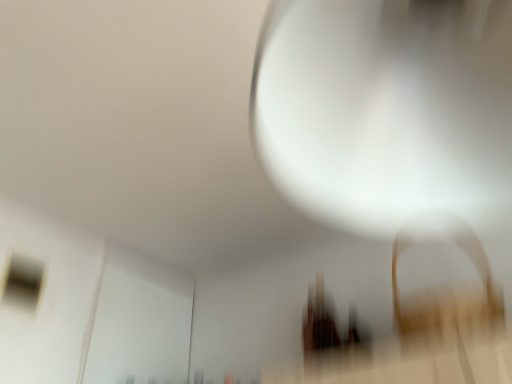
Image resolution: width=512 pixels, height=384 pixels. Describe the element at coordinates (22, 282) in the screenshot. I see `matte glass window at upper left` at that location.

Where is `matte glass window at upper left`? The image size is (512, 384). matte glass window at upper left is located at coordinates (22, 282).

Identify the location of white glossy light bulb at upper center. This screenshot has height=384, width=512. (386, 110).

Describe the element at coordinates (386, 110) in the screenshot. I see `white glossy light bulb at upper center` at that location.

The width and height of the screenshot is (512, 384). Find the location of `matte glass window at upper left`. matte glass window at upper left is located at coordinates (22, 282).

Looking at this image, considering the relative positions of white glossy light bulb at upper center and matte glass window at upper left in the image provided, is white glossy light bulb at upper center to the right of matte glass window at upper left from the viewer's perspective?

Correct, you'll find white glossy light bulb at upper center to the right of matte glass window at upper left.

Considering the relative positions of white glossy light bulb at upper center and matte glass window at upper left in the image provided, is white glossy light bulb at upper center in front of matte glass window at upper left?

Yes, white glossy light bulb at upper center is closer to the viewer.

Between point (482, 74) and point (4, 288), which one is positioned behind?

The point (4, 288) is farther.

From the image's perspective, is white glossy light bulb at upper center below matte glass window at upper left?

No, from the image's perspective, white glossy light bulb at upper center is not below matte glass window at upper left.

From the picture: From a real-world perspective, between white glossy light bulb at upper center and matte glass window at upper left, who is vertically lower?

In real-world perspective, white glossy light bulb at upper center is lower.

Considering the sizes of objects white glossy light bulb at upper center and matte glass window at upper left in the image provided, who is wider, white glossy light bulb at upper center or matte glass window at upper left?

With larger width is white glossy light bulb at upper center.

Is white glossy light bulb at upper center taller or shorter than matte glass window at upper left?

white glossy light bulb at upper center is taller than matte glass window at upper left.

Considering the sizes of objects white glossy light bulb at upper center and matte glass window at upper left in the image provided, who is smaller, white glossy light bulb at upper center or matte glass window at upper left?

With smaller size is matte glass window at upper left.

Could matte glass window at upper left be considered to be inside white glossy light bulb at upper center?

No, matte glass window at upper left is located outside of white glossy light bulb at upper center.

Is white glossy light bulb at upper center not near matte glass window at upper left?

Indeed, white glossy light bulb at upper center is not near matte glass window at upper left.

Is white glossy light bulb at upper center facing away from matte glass window at upper left?

No, white glossy light bulb at upper center's orientation is not away from matte glass window at upper left.

What's the angular difference between white glossy light bulb at upper center and matte glass window at upper left's facing directions?

They differ by 88.2 degrees in their facing directions.

Locate an element on the screen. light in front of the matte glass window at upper left is located at coordinates (386, 110).

Considering the relative positions of matte glass window at upper left and white glossy light bulb at upper center in the image provided, is matte glass window at upper left to the left of white glossy light bulb at upper center from the viewer's perspective?

Correct, you'll find matte glass window at upper left to the left of white glossy light bulb at upper center.

Between matte glass window at upper left and white glossy light bulb at upper center, which one is positioned behind?

matte glass window at upper left is further away from the camera.

Considering the points (40, 284) and (490, 162), which point is behind, point (40, 284) or point (490, 162)?

The point (40, 284) is farther from the camera.

From the image's perspective, would you say matte glass window at upper left is shown under white glossy light bulb at upper center?

Indeed, from the image's perspective, matte glass window at upper left is shown beneath white glossy light bulb at upper center.

From a real-world perspective, which is physically below, matte glass window at upper left or white glossy light bulb at upper center?

In real-world perspective, white glossy light bulb at upper center is lower.

Considering the sizes of matte glass window at upper left and white glossy light bulb at upper center in the image, is matte glass window at upper left wider or thinner than white glossy light bulb at upper center?

Considering their sizes, matte glass window at upper left looks slimmer than white glossy light bulb at upper center.

From the picture: Who is taller, matte glass window at upper left or white glossy light bulb at upper center?

white glossy light bulb at upper center is taller.

In terms of size, does matte glass window at upper left appear bigger or smaller than white glossy light bulb at upper center?

In the image, matte glass window at upper left appears to be smaller than white glossy light bulb at upper center.

In the scene shown: Is matte glass window at upper left inside the boundaries of white glossy light bulb at upper center, or outside?

matte glass window at upper left is not inside white glossy light bulb at upper center, it's outside.

Is matte glass window at upper left not close to white glossy light bulb at upper center?

Indeed, matte glass window at upper left is not near white glossy light bulb at upper center.

Could you tell me if matte glass window at upper left is turned towards white glossy light bulb at upper center?

Yes, matte glass window at upper left is oriented towards white glossy light bulb at upper center.

Locate an element on the screen. light in front of the matte glass window at upper left is located at coordinates (386, 110).

Locate an element on the screen. Image resolution: width=512 pixels, height=384 pixels. light above the matte glass window at upper left (from the image's perspective) is located at coordinates (386, 110).

In order to click on light in front of the matte glass window at upper left in this screenshot , I will do `click(386, 110)`.